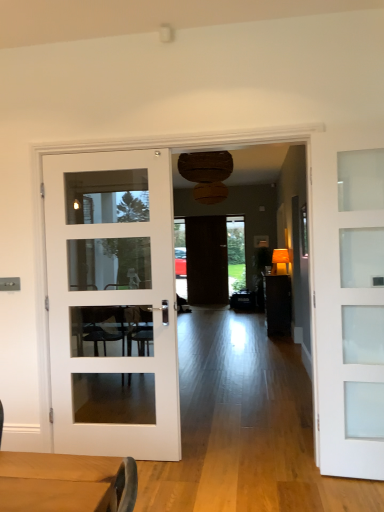
Question: Would you say matte brown table at center is inside or outside dark wood door at center, which appears as the second door when viewed from the right?

Choices:
 (A) outside
 (B) inside

Answer: (A)

Question: Is matte brown table at center wider or thinner than dark wood door at center, the 2th door from the left?

Choices:
 (A) wide
 (B) thin

Answer: (A)

Question: Which of these objects is positioned farthest from the dark wood door at center, the 3th door from the front?

Choices:
 (A) white glass door at left, arranged as the second door when viewed from the back
 (B) green glass window at right
 (C) matte brown table at center
 (D) white frosted glass door at right, the 1th door viewed from the right

Answer: (D)

Question: Considering the real-world distances, which object is farthest from the matte brown table at center?

Choices:
 (A) white frosted glass door at right, the 1th door viewed from the right
 (B) dark wood door at center, the 2th door from the left
 (C) white glass door at left, the 3th door when ordered from right to left
 (D) green glass window at right

Answer: (A)